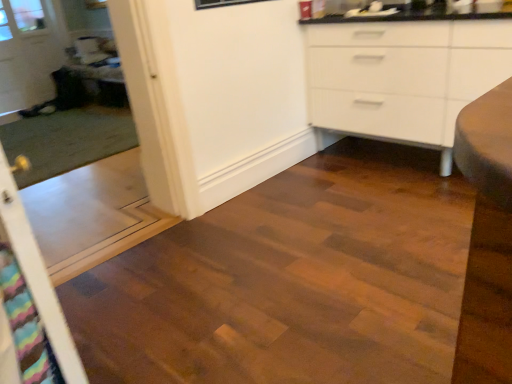
Question: Does wooden table at left appear on the right side of transparent plastic screen door at left, the 2th screen door from the front?

Choices:
 (A) yes
 (B) no

Answer: (B)

Question: From the image's perspective, is wooden table at left on top of transparent plastic screen door at left, which appears as the 1th screen door when viewed from the back?

Choices:
 (A) yes
 (B) no

Answer: (A)

Question: Is wooden table at left far from transparent plastic screen door at left, which appears as the 1th screen door when viewed from the back?

Choices:
 (A) yes
 (B) no

Answer: (B)

Question: Is wooden table at left aimed at transparent plastic screen door at left, the 2th screen door from the front?

Choices:
 (A) no
 (B) yes

Answer: (A)

Question: Considering the relative sizes of wooden table at left and transparent plastic screen door at left, the 2th screen door from the front, in the image provided, is wooden table at left thinner than transparent plastic screen door at left, the 2th screen door from the front,?

Choices:
 (A) no
 (B) yes

Answer: (A)

Question: Does wooden table at left appear on the left side of transparent plastic screen door at left, the 2th screen door from the front?

Choices:
 (A) no
 (B) yes

Answer: (B)

Question: From a real-world perspective, is multicolored fabric screen door at left, which is the first screen door from front to back, below transparent glass door at upper left?

Choices:
 (A) yes
 (B) no

Answer: (A)

Question: From the image's perspective, is multicolored fabric screen door at left, acting as the 2th screen door starting from the back, located beneath transparent glass door at upper left?

Choices:
 (A) yes
 (B) no

Answer: (A)

Question: Is multicolored fabric screen door at left, which is the first screen door from front to back, placed right next to transparent glass door at upper left?

Choices:
 (A) yes
 (B) no

Answer: (B)

Question: Is multicolored fabric screen door at left, acting as the 2th screen door starting from the back, smaller than transparent glass door at upper left?

Choices:
 (A) yes
 (B) no

Answer: (A)

Question: From the image's perspective, is multicolored fabric screen door at left, acting as the 2th screen door starting from the back, on transparent glass door at upper left?

Choices:
 (A) no
 (B) yes

Answer: (A)

Question: Does multicolored fabric screen door at left, which is the first screen door from front to back, have a lesser width compared to transparent glass door at upper left?

Choices:
 (A) yes
 (B) no

Answer: (B)

Question: Could you tell me if transparent glass door at upper left is turned towards transparent plastic screen door at left, which appears as the 1th screen door when viewed from the back?

Choices:
 (A) yes
 (B) no

Answer: (A)